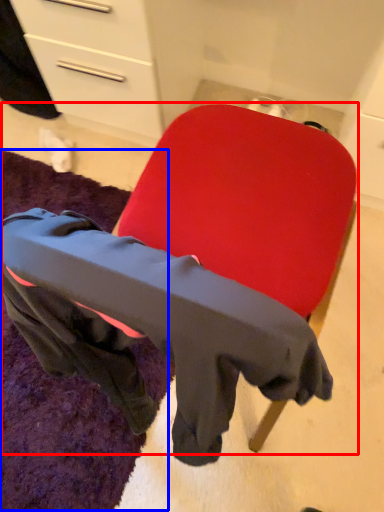
Question: Which object is closer to the camera taking this photo, chair (highlighted by a red box) or mat (highlighted by a blue box)?

Choices:
 (A) chair
 (B) mat

Answer: (A)